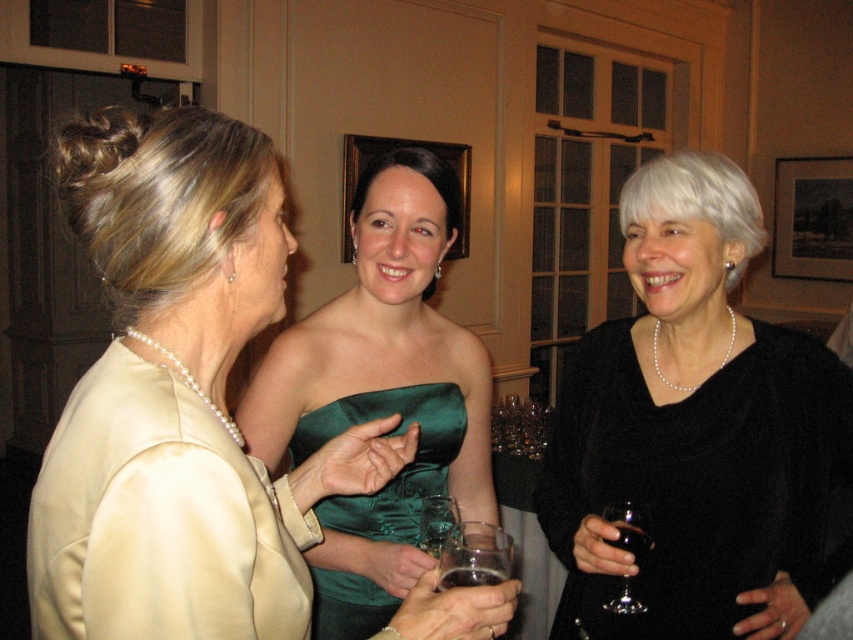
Can you confirm if black matte dress at right is positioned to the right of translucent glass at lower right?

Yes, black matte dress at right is to the right of translucent glass at lower right.

Between point (578, 611) and point (633, 547), which one is positioned behind?

Positioned behind is point (578, 611).

Locate an element on the screen. black matte dress at right is located at coordinates (695, 429).

Is black matte dress at right taller than clear glass at center?

Indeed, black matte dress at right has a greater height compared to clear glass at center.

Which is below, black matte dress at right or clear glass at center?

black matte dress at right is lower down.

Image resolution: width=853 pixels, height=640 pixels. What do you see at coordinates (695, 429) in the screenshot? I see `black matte dress at right` at bounding box center [695, 429].

This screenshot has height=640, width=853. In order to click on black matte dress at right in this screenshot , I will do `click(695, 429)`.

Is point (641, 516) more distant than point (647, 541)?

No, (641, 516) is in front of (647, 541).

Who is higher up, transparent glass wine glass at lower right or translucent glass at lower right?

translucent glass at lower right is higher up.

Between point (639, 563) and point (643, 544), which one is positioned behind?

The point (639, 563) is behind.

Locate an element on the screen. This screenshot has height=640, width=853. transparent glass wine glass at lower right is located at coordinates (630, 529).